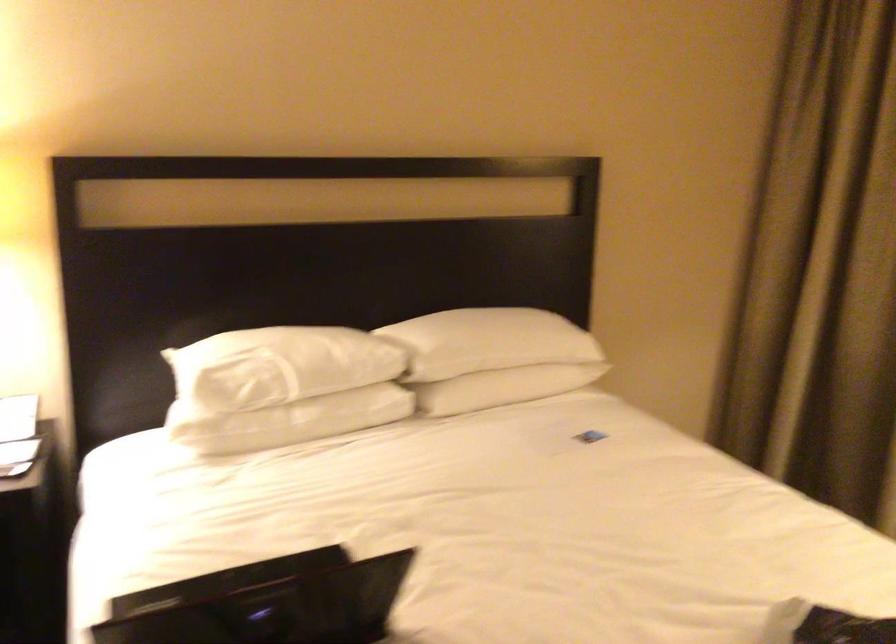
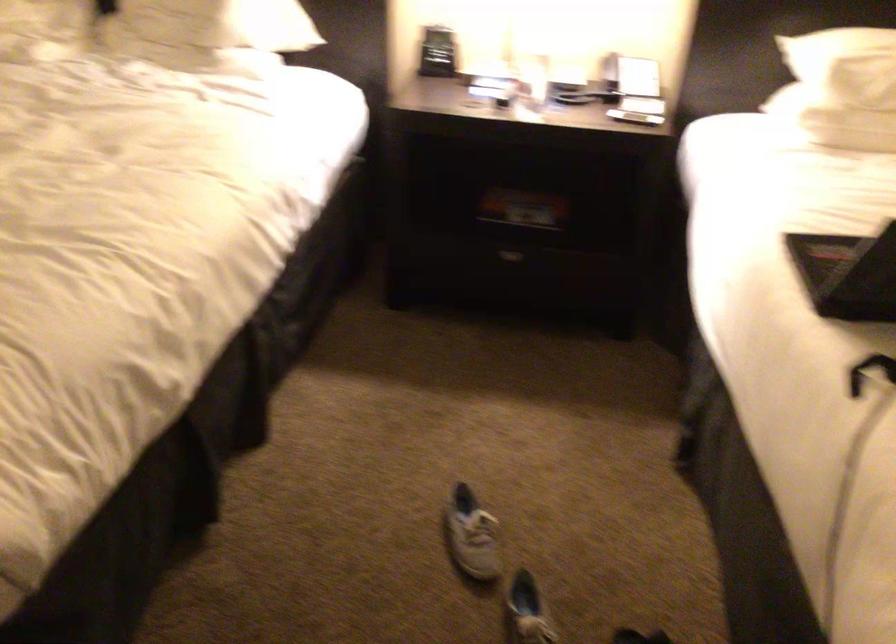
Based on the continuous images, in which direction is the camera rotating?

The camera rotated toward left-down.